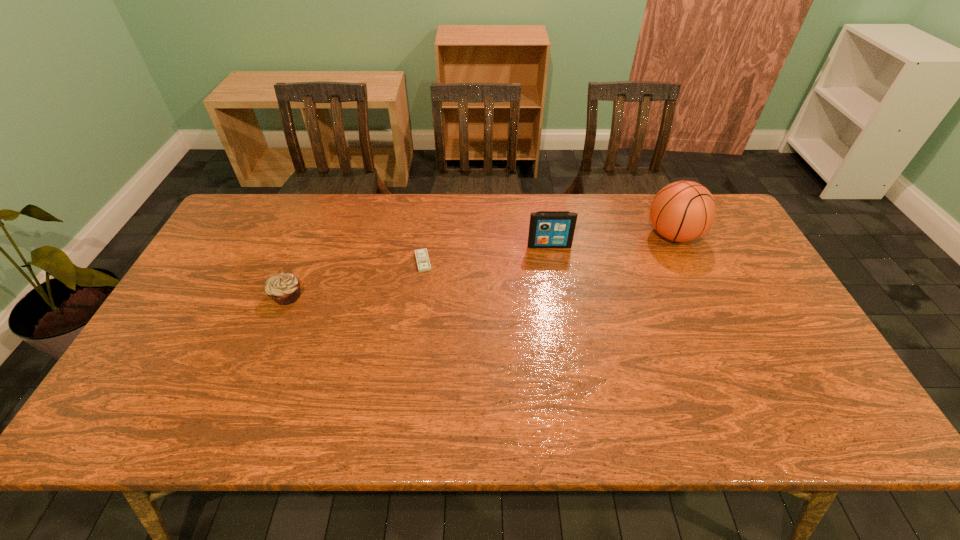
At what (x,y) coordinates should I click in order to perform the action: click on vacant region located 0.290m on the right of the nearest object. Please return your answer as a coordinate pair (x, y). The image size is (960, 540). Looking at the image, I should click on (408, 296).

At what (x,y) coordinates should I click in order to perform the action: click on free space located 0.370m on the left of the shortest object. Please return your answer as a coordinate pair (x, y). This screenshot has width=960, height=540. Looking at the image, I should click on (290, 261).

Where is `object that is at the far edge`? object that is at the far edge is located at coordinates (682, 211).

In order to click on object at the right edge in this screenshot , I will do point(682,211).

This screenshot has width=960, height=540. I want to click on object located in the far right corner section of the desktop, so click(682, 211).

In the image, there is a desktop. At what (x,y) coordinates should I click in order to perform the action: click on vacant space at the far edge. Please return your answer as a coordinate pair (x, y). Looking at the image, I should click on (470, 237).

At what (x,y) coordinates should I click in order to perform the action: click on vacant space at the near edge of the desktop. Please return your answer as a coordinate pair (x, y). Looking at the image, I should click on (399, 418).

Where is `free spot at the left edge of the desktop`? free spot at the left edge of the desktop is located at coordinates (212, 273).

Where is `vacant space at the right edge of the desktop`? The image size is (960, 540). vacant space at the right edge of the desktop is located at coordinates (804, 362).

At what (x,y) coordinates should I click in order to perform the action: click on vacant area at the far left corner of the desktop. Please return your answer as a coordinate pair (x, y). This screenshot has height=540, width=960. Looking at the image, I should click on (287, 195).